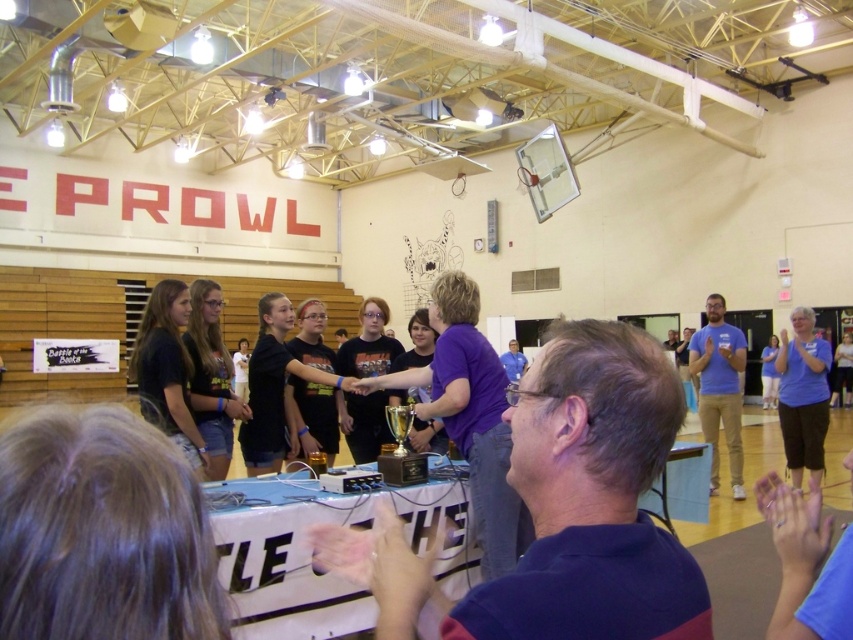
You are a photographer at the gymnasium and need to capture a clear shot of both the blue fabric shirt at right and the blue cotton shirt at right. Since both shirts are blue, how can you distinguish which one is closer to the camera?

The blue fabric shirt at right is positioned over the blue cotton shirt at right, so the one appearing in front would be the blue fabric shirt at right.